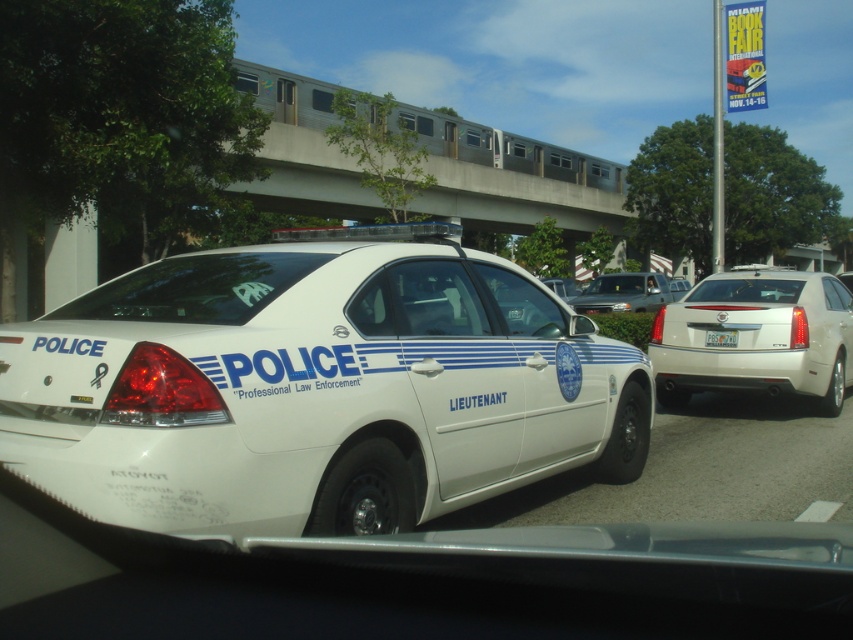
You are a passenger in the white glossy sedan at center. You notice a white plastic license plate at center and want to check its number. Which side of the sedan should you look towards to see the license plate?

The white plastic license plate at center is to the left of the white glossy sedan at center, so you should look towards the left side of the sedan to see it.